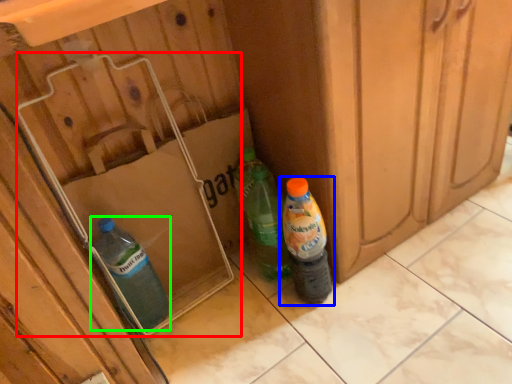
Question: Considering the real-world distances, which object is closest to cardboard box (highlighted by a red box)? bottle (highlighted by a blue box) or bottle (highlighted by a green box).

Choices:
 (A) bottle
 (B) bottle

Answer: (B)